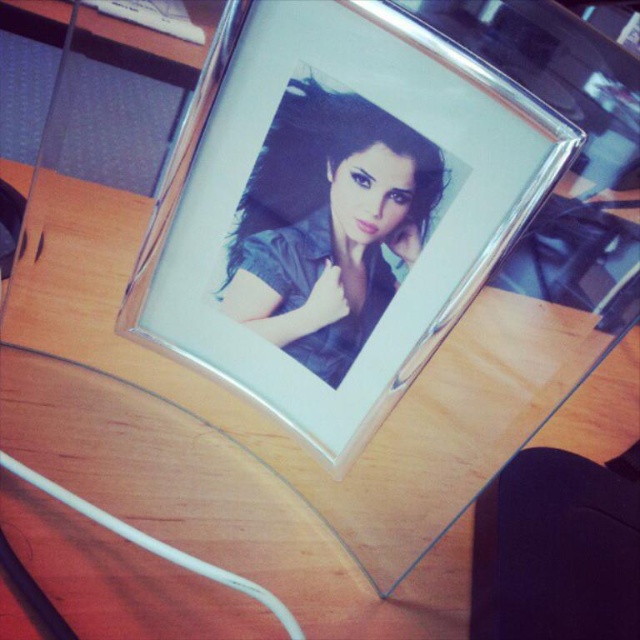
You are looking at the framed photograph on the wooden desk. There are two points marked on the desk surface. The first point is at coordinates point (394, 19) and the second at point (369, 170). If you were to place a small sticker on the desk, which point would require you to move your hand less to reach it?

Point (394, 19) is closer to the camera than point (369, 170), so you would need to move your hand less to reach it.

You are organizing a desk and need to place a new object between the silver metallic photo frame at center and the satin black photo frame at center. The object requires 1 inch of space. Is there enough space between them?

The distance between the silver metallic photo frame at center and the satin black photo frame at center is 0.67 inches, which is less than the required 1 inch. Therefore, there is not enough space to place the object between them.

You are holding a pen and want to mark the point at the center of the framed photograph on the wooden desk. The framed photograph is placed such that its center is at point (256, 168). If you are currently 16.36 inches away from this point, can you reach it without moving your hand?

The point at (256, 168) is 16.36 inches away from you. Since the average human hand span is about 7 to 9 inches, you would need to move closer to reach the point as 16.36 inches exceeds typical reach without extending your arm fully.